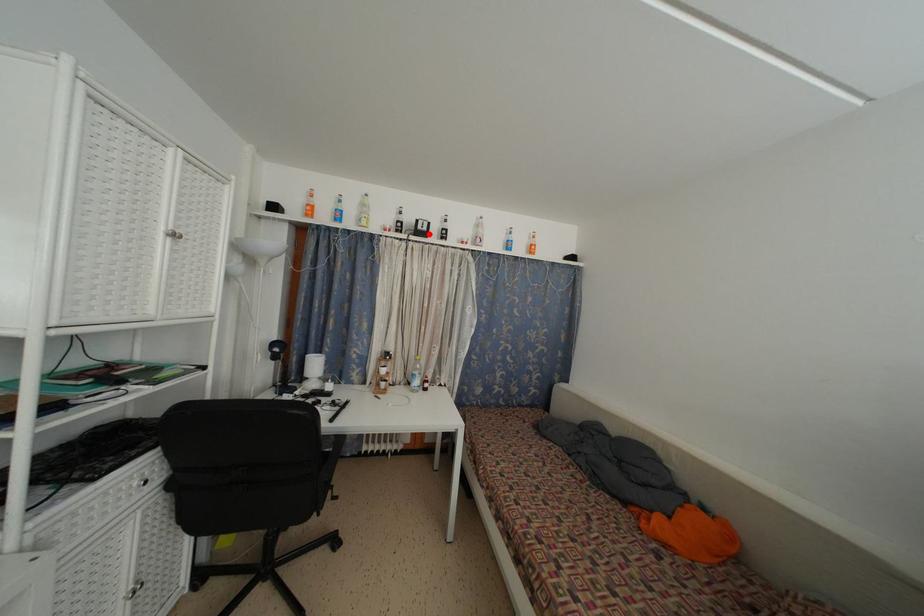
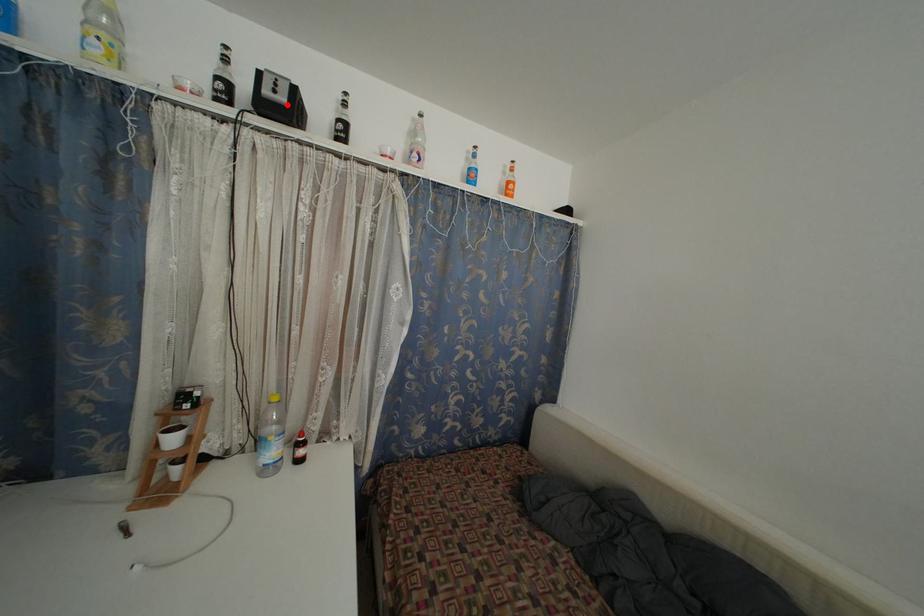
I am providing you with two images of the same scene from different viewpoints. A red point is marked on the first image and another point is marked on the second image. Is the marked point in image1 the same physical position as the marked point in image2?

Yes